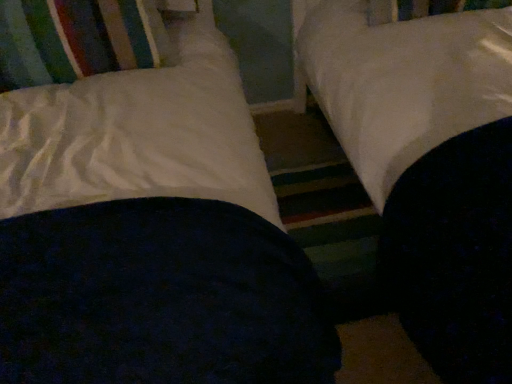
What do you see at coordinates (76, 39) in the screenshot? I see `white satin pillow at upper left` at bounding box center [76, 39].

Locate an element on the screen. This screenshot has width=512, height=384. white satin pillow at upper left is located at coordinates (76, 39).

The height and width of the screenshot is (384, 512). I want to click on white satin pillow at upper left, so click(76, 39).